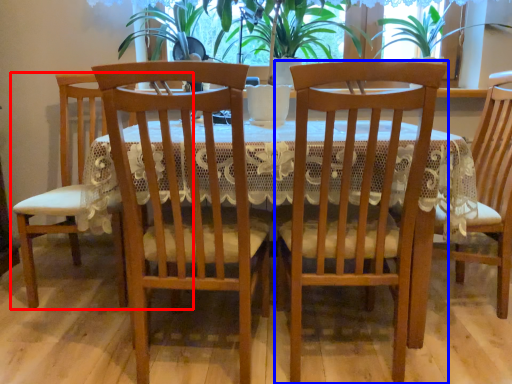
Question: Which object appears farthest to the camera in this image, chair (highlighted by a red box) or chair (highlighted by a blue box)?

Choices:
 (A) chair
 (B) chair

Answer: (A)